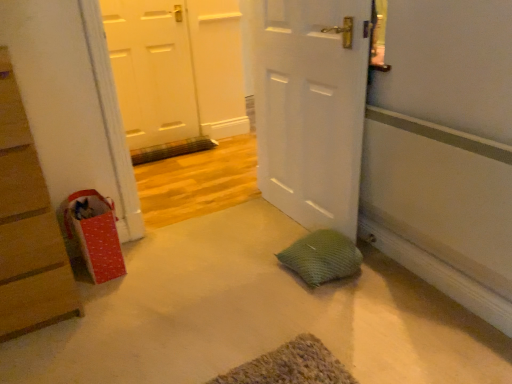
Image resolution: width=512 pixels, height=384 pixels. I want to click on free space to the left of white matte door at center, which appears as the 2th door when viewed from the back, so click(225, 241).